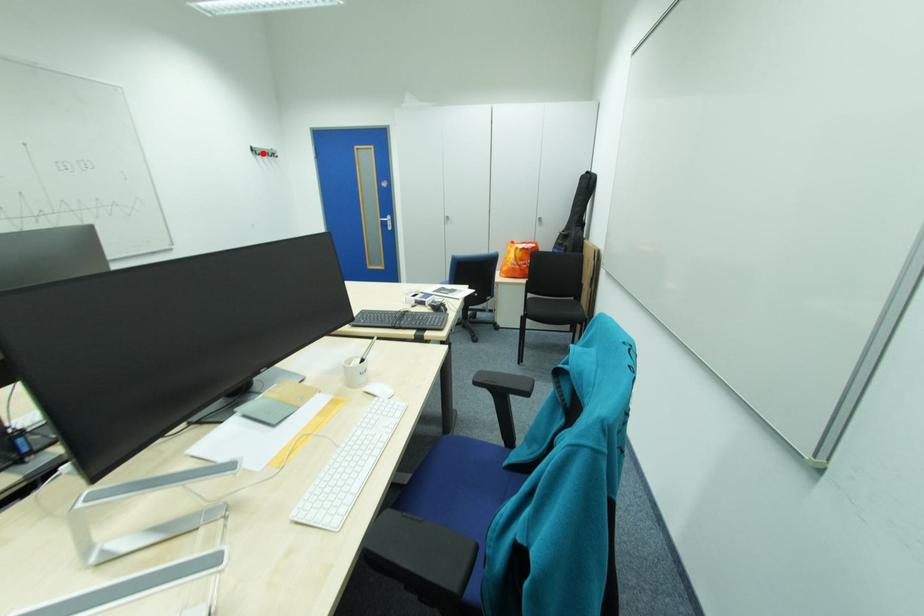
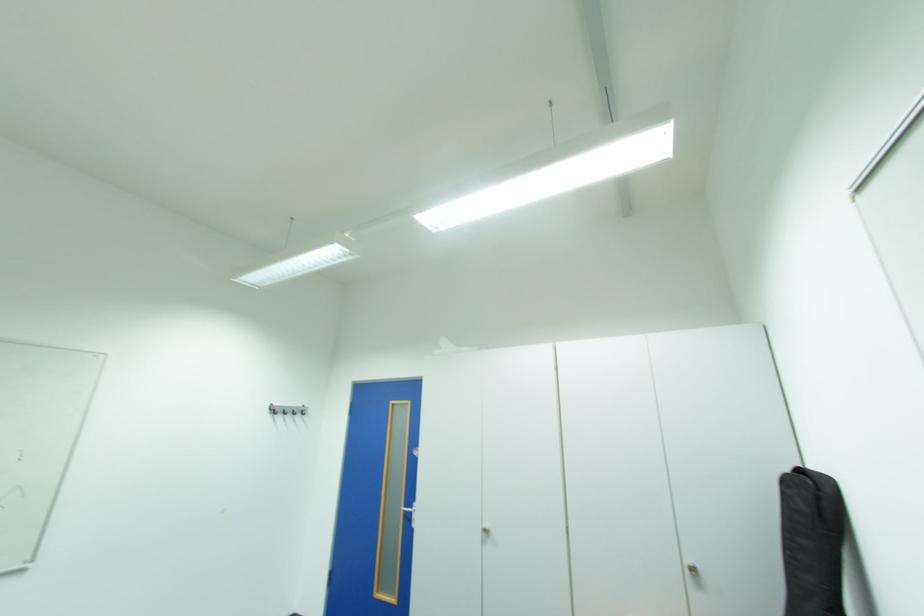
In the second image, find the point that corresponds to the highlighted location in the first image.

(280, 411)